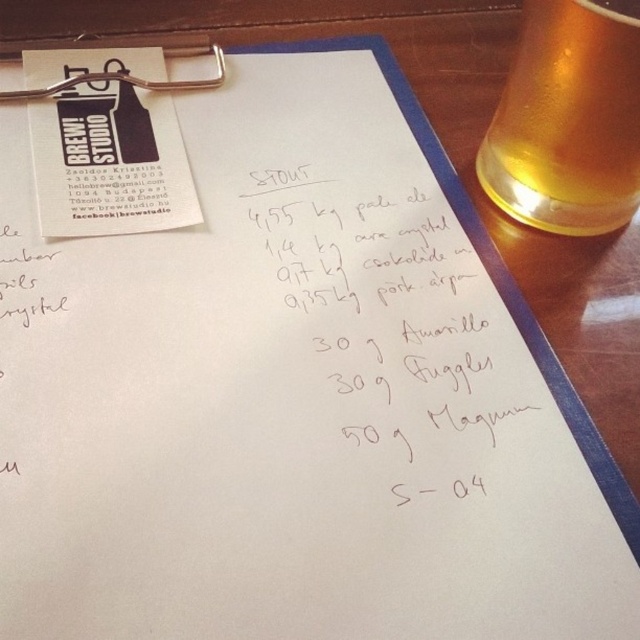
Question: From the image, what is the correct spatial relationship of black paper at center in relation to translucent glass beer at upper right?

Choices:
 (A) left
 (B) right

Answer: (A)

Question: Which point appears closest to the camera in this image?

Choices:
 (A) (552, 193)
 (B) (369, 205)

Answer: (A)

Question: Which of the following is the closest to the observer?

Choices:
 (A) black paper at center
 (B) translucent glass beer at upper right

Answer: (A)

Question: Can you confirm if black paper at center is wider than translucent glass beer at upper right?

Choices:
 (A) yes
 (B) no

Answer: (A)

Question: Can you confirm if black paper at center is bigger than translucent glass beer at upper right?

Choices:
 (A) no
 (B) yes

Answer: (B)